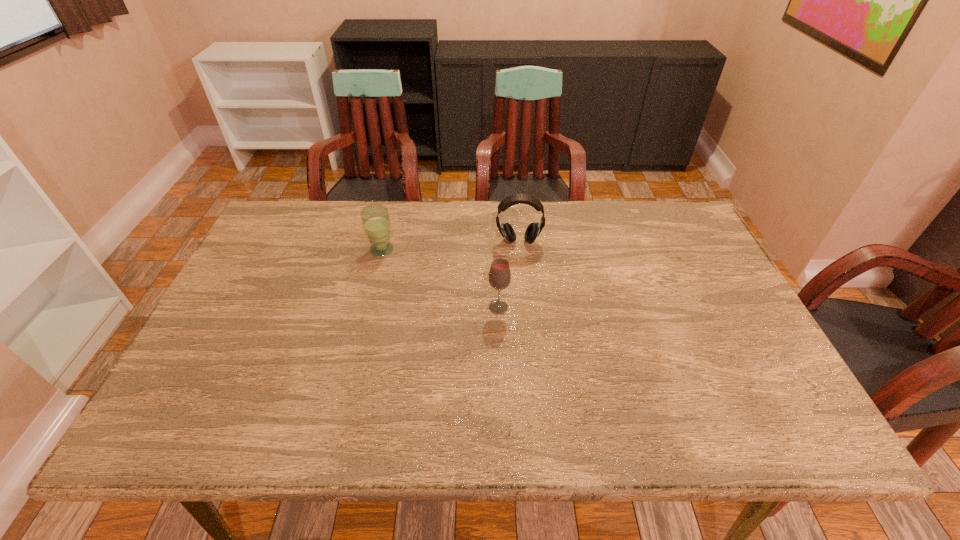
I want to click on earphone, so click(x=533, y=230).

At what (x,y) coordinates should I click in order to perform the action: click on the nearer glass. Please return your answer as a coordinate pair (x, y). This screenshot has height=540, width=960. Looking at the image, I should click on (499, 275).

This screenshot has height=540, width=960. Identify the location of the right glass. (499, 275).

Locate an element on the screen. the farther glass is located at coordinates (375, 218).

Locate an element on the screen. The image size is (960, 540). the leftmost object is located at coordinates (375, 218).

This screenshot has height=540, width=960. What are the coordinates of `vacant position located on the ear cups of the earphone` in the screenshot? It's located at (527, 322).

Locate an element on the screen. This screenshot has width=960, height=540. free space located on the front of the nearer glass is located at coordinates (503, 414).

This screenshot has width=960, height=540. Find the location of `free location located on the front of the left glass`. free location located on the front of the left glass is located at coordinates (375, 275).

Where is `earphone located in the far edge section of the desktop`? earphone located in the far edge section of the desktop is located at coordinates (533, 230).

Identify the location of glass present at the far edge. (375, 218).